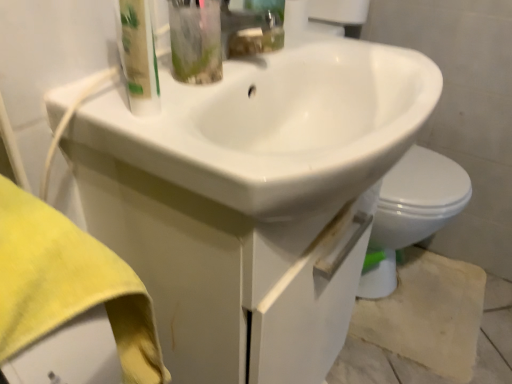
What do you see at coordinates (276, 125) in the screenshot?
I see `white glossy sink at center` at bounding box center [276, 125].

At what (x,y) coordinates should I click in order to perform the action: click on beige textured concrete at lower right. Please return your answer as a coordinate pair (x, y). Looking at the image, I should click on (431, 327).

The image size is (512, 384). In order to click on white glossy sink at center in this screenshot , I will do `click(276, 125)`.

From the image's perspective, is translucent plastic bottle at upper left positioned above or below white glossy drawer at center?

translucent plastic bottle at upper left is above white glossy drawer at center.

The height and width of the screenshot is (384, 512). Find the location of `cleaning product above the white glossy drawer at center (from the image's perspective)`. cleaning product above the white glossy drawer at center (from the image's perspective) is located at coordinates pos(138,56).

Which object is positioned more to the left, translucent plastic bottle at upper left or white glossy drawer at center?

Positioned to the left is translucent plastic bottle at upper left.

Which object is positioned more to the left, beige textured concrete at lower right or translucent plastic bottle at upper left?

translucent plastic bottle at upper left is more to the left.

From a real-world perspective, is beige textured concrete at lower right over translucent plastic bottle at upper left?

No, from a real-world perspective, beige textured concrete at lower right is not above translucent plastic bottle at upper left.

Who is smaller, beige textured concrete at lower right or translucent plastic bottle at upper left?

translucent plastic bottle at upper left.

From the image's perspective, which is below, beige textured concrete at lower right or translucent plastic bottle at upper left?

beige textured concrete at lower right, from the image's perspective.

Is white glossy drawer at center positioned with its back to beige textured concrete at lower right?

No.

Which of these two, white glossy drawer at center or beige textured concrete at lower right, stands shorter?

beige textured concrete at lower right is shorter.

Which is in front, point (325, 247) or point (447, 303)?

The point (325, 247) is in front.

From a real-world perspective, who is located lower, white glossy drawer at center or beige textured concrete at lower right?

beige textured concrete at lower right, from a real-world perspective.

Between white glossy sink at center and translucent plastic bottle at upper left, which one has smaller size?

Smaller between the two is translucent plastic bottle at upper left.

Between white glossy sink at center and translucent plastic bottle at upper left, which one has less height?

Standing shorter between the two is white glossy sink at center.

From a real-world perspective, between white glossy sink at center and translucent plastic bottle at upper left, who is vertically lower?

white glossy sink at center, from a real-world perspective.

Is white glossy drawer at center aimed at white glossy sink at center?

No, white glossy drawer at center is not facing towards white glossy sink at center.

The height and width of the screenshot is (384, 512). In order to click on sink above the white glossy drawer at center (from the image's perspective) in this screenshot , I will do `click(276, 125)`.

Considering the sizes of white glossy drawer at center and white glossy sink at center in the image, is white glossy drawer at center bigger or smaller than white glossy sink at center?

In the image, white glossy drawer at center appears to be larger than white glossy sink at center.

Is white glossy drawer at center outside of white glossy sink at center?

Yes.

Is beige textured concrete at lower right wider than white glossy drawer at center?

Yes.

Would you say beige textured concrete at lower right contains white glossy drawer at center?

No, white glossy drawer at center is located outside of beige textured concrete at lower right.

Does beige textured concrete at lower right appear on the left side of white glossy drawer at center?

In fact, beige textured concrete at lower right is to the right of white glossy drawer at center.

Is white glossy sink at center oriented towards beige textured concrete at lower right?

No, white glossy sink at center is not oriented towards beige textured concrete at lower right.

Between white glossy sink at center and beige textured concrete at lower right, which one is positioned behind?

beige textured concrete at lower right is behind.

From their relative heights in the image, would you say white glossy sink at center is taller or shorter than beige textured concrete at lower right?

In the image, white glossy sink at center appears to be taller than beige textured concrete at lower right.

This screenshot has width=512, height=384. I want to click on drawer behind the translucent plastic bottle at upper left, so click(230, 274).

Identify the location of cleaning product in front of the beige textured concrete at lower right. The width and height of the screenshot is (512, 384). (138, 56).

Considering their positions, is beige textured concrete at lower right positioned further to white glossy sink at center than white glossy drawer at center?

Among the two, beige textured concrete at lower right is located further to white glossy sink at center.

Which object lies further to the anchor point beige textured concrete at lower right, white glossy sink at center or white glossy drawer at center?

Based on the image, white glossy sink at center appears to be further to beige textured concrete at lower right.

Estimate the real-world distances between objects in this image. Which object is further from translucent plastic bottle at upper left, white glossy drawer at center or beige textured concrete at lower right?

The object further to translucent plastic bottle at upper left is beige textured concrete at lower right.

Looking at the image, which one is located further to white glossy sink at center, white glossy drawer at center or translucent plastic bottle at upper left?

The object further to white glossy sink at center is translucent plastic bottle at upper left.

Looking at the image, which one is located closer to translucent plastic bottle at upper left, white glossy drawer at center or white glossy sink at center?

The object closer to translucent plastic bottle at upper left is white glossy sink at center.

When comparing their distances from white glossy drawer at center, does white glossy sink at center or beige textured concrete at lower right seem closer?

Based on the image, white glossy sink at center appears to be nearer to white glossy drawer at center.

Based on their spatial positions, is white glossy sink at center or translucent plastic bottle at upper left closer to beige textured concrete at lower right?

white glossy sink at center.

When comparing their distances from white glossy drawer at center, does translucent plastic bottle at upper left or beige textured concrete at lower right seem further?

Among the two, beige textured concrete at lower right is located further to white glossy drawer at center.

Locate an element on the screen. The height and width of the screenshot is (384, 512). sink that lies between translucent plastic bottle at upper left and white glossy drawer at center from top to bottom is located at coordinates (276, 125).

What are the coordinates of `drawer located between translucent plastic bottle at upper left and beige textured concrete at lower right in the depth direction` in the screenshot? It's located at (230, 274).

The height and width of the screenshot is (384, 512). Identify the location of drawer between white glossy sink at center and beige textured concrete at lower right from front to back. (230, 274).

You are a GUI agent. You are given a task and a screenshot of the screen. Output one action in this format:
    pyautogui.click(x=<x>, y=<y>)
    Task: Click on the cleaning product between white glossy sink at center and beige textured concrete at lower right in the front-back direction
    This screenshot has width=512, height=384.
    Given the screenshot: What is the action you would take?
    pyautogui.click(x=138, y=56)